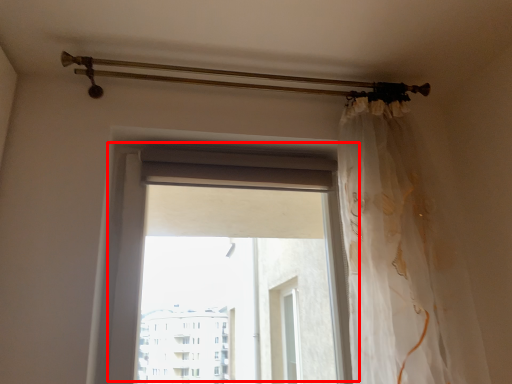
Question: In this image, where is window (annotated by the red box) located relative to curtain?

Choices:
 (A) left
 (B) right

Answer: (A)